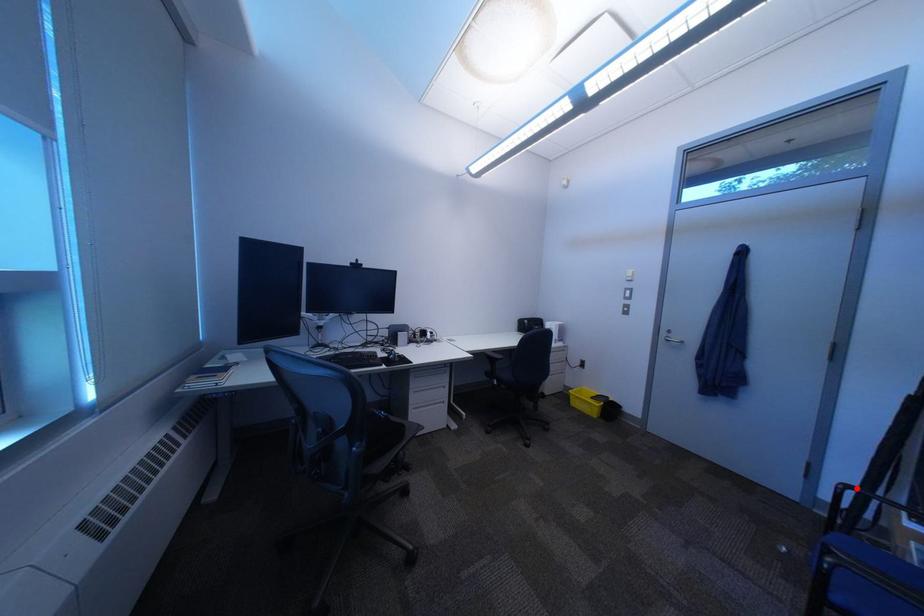
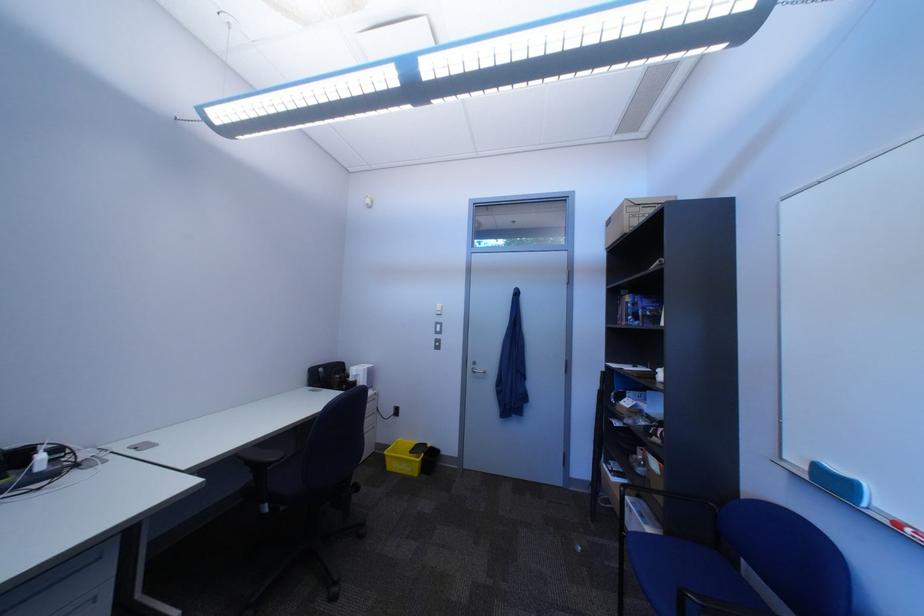
Question: I am providing you with two images of the same scene from different viewpoints. A red point is shown in image1. For the corresponding object point in image2, is it positioned nearer or farther from the camera?

Choices:
 (A) Nearer
 (B) Farther

Answer: (A)